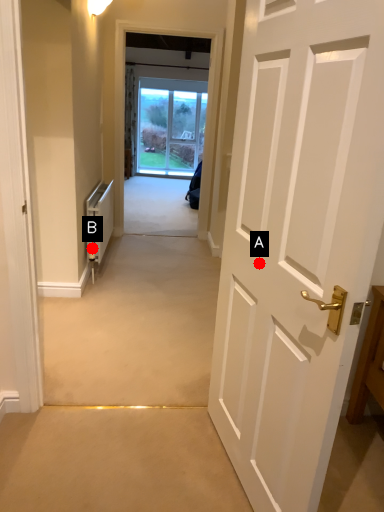
Question: Two points are circled on the image, labeled by A and B beside each circle. Which point appears closest to the camera in this image?

Choices:
 (A) A is closer
 (B) B is closer

Answer: (A)